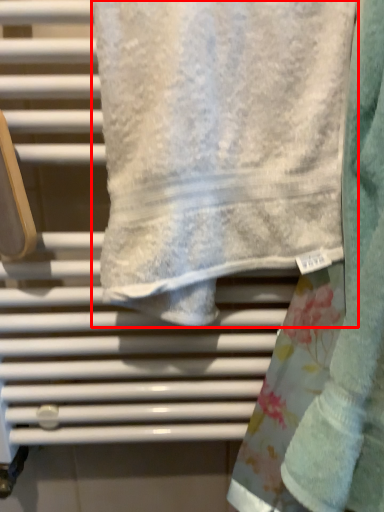
Question: From the image, what is the correct spatial relationship of towel (annotated by the red box) in relation to towel?

Choices:
 (A) right
 (B) left

Answer: (B)